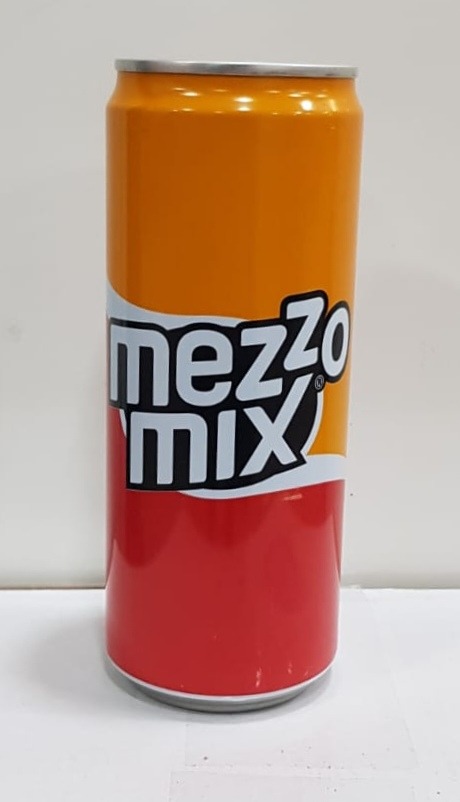
Locate an element on the screen. This screenshot has width=460, height=802. table is located at coordinates (71, 731).